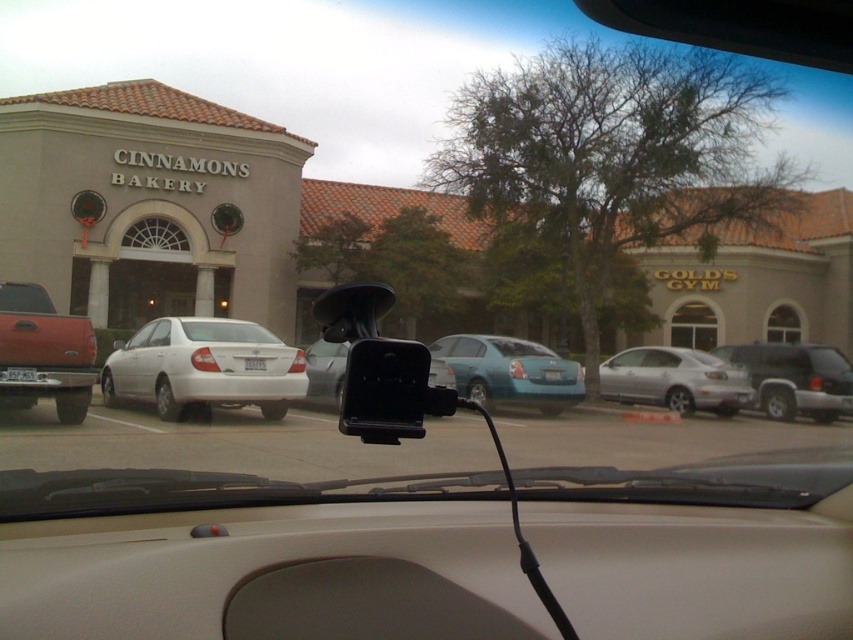
Does silver metallic suv at right appear under satin black camera at center?

No.

How much distance is there between silver metallic suv at right and satin black camera at center?

The distance of silver metallic suv at right from satin black camera at center is 28.89 feet.

Find the location of a particular element. silver metallic suv at right is located at coordinates (793, 378).

Where is `silver metallic suv at right`? The width and height of the screenshot is (853, 640). silver metallic suv at right is located at coordinates (793, 378).

Can you confirm if white matte sedan at center is positioned below silver metallic suv at right?

No.

Does white matte sedan at center lie behind silver metallic suv at right?

No.

Which is behind, point (183, 355) or point (798, 387)?

The point (798, 387) is behind.

You are a GUI agent. You are given a task and a screenshot of the screen. Output one action in this format:
    pyautogui.click(x=<x>, y=<y>)
    Task: Click on the white matte sedan at center
    This screenshot has width=853, height=640.
    Given the screenshot: What is the action you would take?
    pyautogui.click(x=204, y=368)

Based on the photo, measure the distance between teal matte sedan at center and silver metallic suv at right.

They are 17.98 feet apart.

Is point (498, 356) less distant than point (763, 396)?

Yes, it is.

At what (x,y) coordinates should I click in order to perform the action: click on teal matte sedan at center. Please return your answer as a coordinate pair (x, y). This screenshot has height=640, width=853. Looking at the image, I should click on (509, 372).